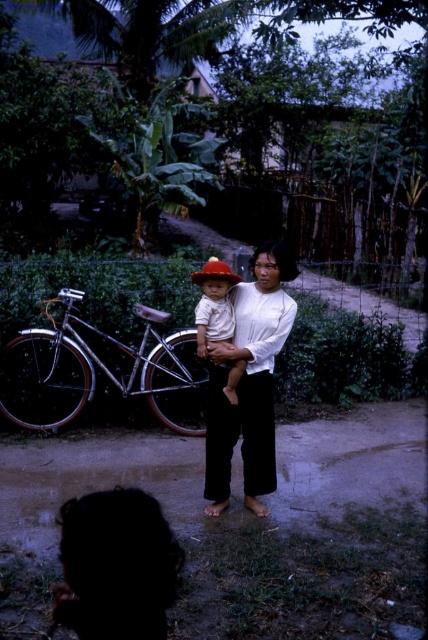
Question: Is silky black hair at lower left smaller than matte white blouse at center?

Choices:
 (A) no
 (B) yes

Answer: (B)

Question: Among these points, which one is nearest to the camera?

Choices:
 (A) (262, 483)
 (B) (204, 358)

Answer: (B)

Question: Can you confirm if silky black hair at lower left is bigger than white cotton shirt at center?

Choices:
 (A) yes
 (B) no

Answer: (B)

Question: Observing the image, what is the correct spatial positioning of silky black hair at lower left in reference to white cotton shirt at center?

Choices:
 (A) left
 (B) right

Answer: (A)

Question: Which point is farther to the camera?

Choices:
 (A) (228, 324)
 (B) (134, 564)

Answer: (A)

Question: Which point is farther to the camera?

Choices:
 (A) matte white blouse at center
 (B) white cotton shirt at center
 (C) silky black hair at lower left

Answer: (B)